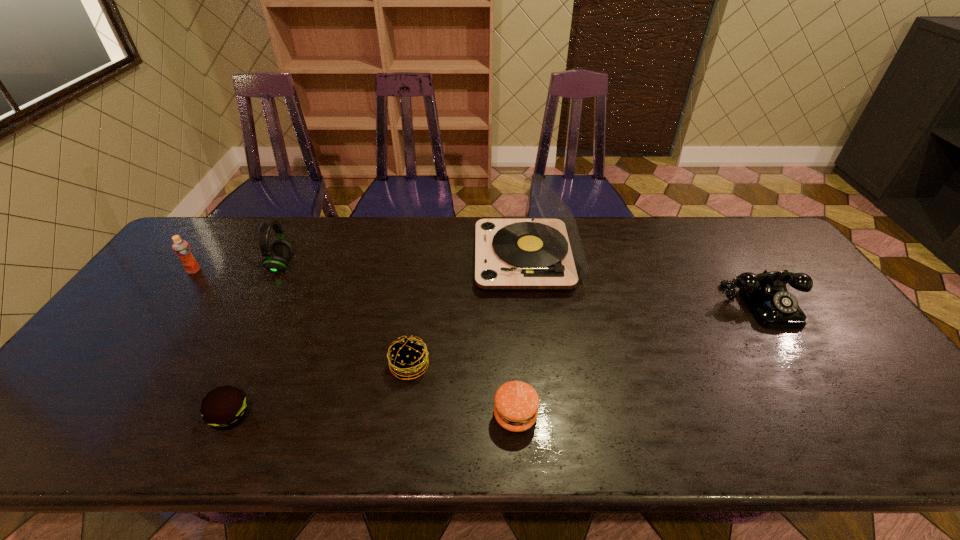
The height and width of the screenshot is (540, 960). I want to click on the closest object relative to the orange juice, so click(276, 258).

At what (x,y) coordinates should I click in order to perform the action: click on the closest patty to the second patty from left to right. Please return your answer as a coordinate pair (x, y). The image size is (960, 540). Looking at the image, I should click on (516, 406).

I want to click on patty that is the second closest to the leftmost patty, so click(516, 406).

Where is `free point that satisfies the following two spatial constraints: 1. with the tonearm facing the front of the tallest object; 2. on the front side of the leftmost patty`? free point that satisfies the following two spatial constraints: 1. with the tonearm facing the front of the tallest object; 2. on the front side of the leftmost patty is located at coordinates (546, 416).

Image resolution: width=960 pixels, height=540 pixels. In order to click on free space that satisfies the following two spatial constraints: 1. on the back side of the leftmost patty; 2. on the left side of the fourth object from right to left in this screenshot , I will do 253,366.

Find the location of a particular element. The width and height of the screenshot is (960, 540). vacant area in the image that satisfies the following two spatial constraints: 1. with the tonearm facing the front of the tallest object; 2. on the front side of the orange juice is located at coordinates (529, 271).

The height and width of the screenshot is (540, 960). What are the coordinates of `vacant region that satisfies the following two spatial constraints: 1. on the front side of the fourth object from left to right; 2. on the right side of the rightmost patty` in the screenshot? It's located at (402, 415).